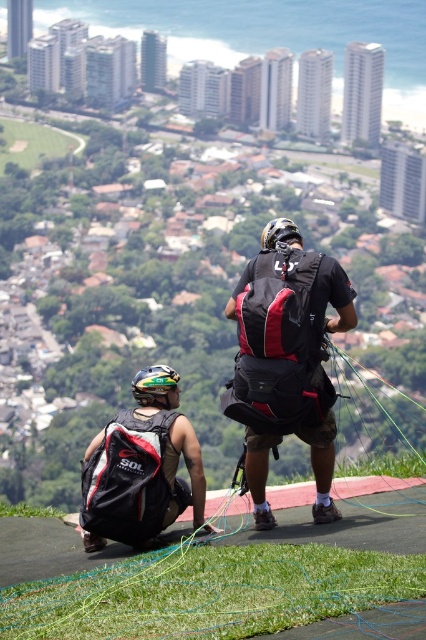
You are a hiker planning to carry both the matte black backpack at center and the matte black backpack at lower left. Which backpack should you choose if you need to carry more gear?

The matte black backpack at center is larger in size than the matte black backpack at lower left, so you should choose the matte black backpack at center to carry more gear.

You are a hiker who needs to choose a backpack for a multi day trip. You see two options in the scene, the matte black backpack at center and the matte black backpack at lower left. Which backpack is taller?

The matte black backpack at center is much taller than the matte black backpack at lower left, so you should choose the matte black backpack at center if you need a taller one for your multi day trip.